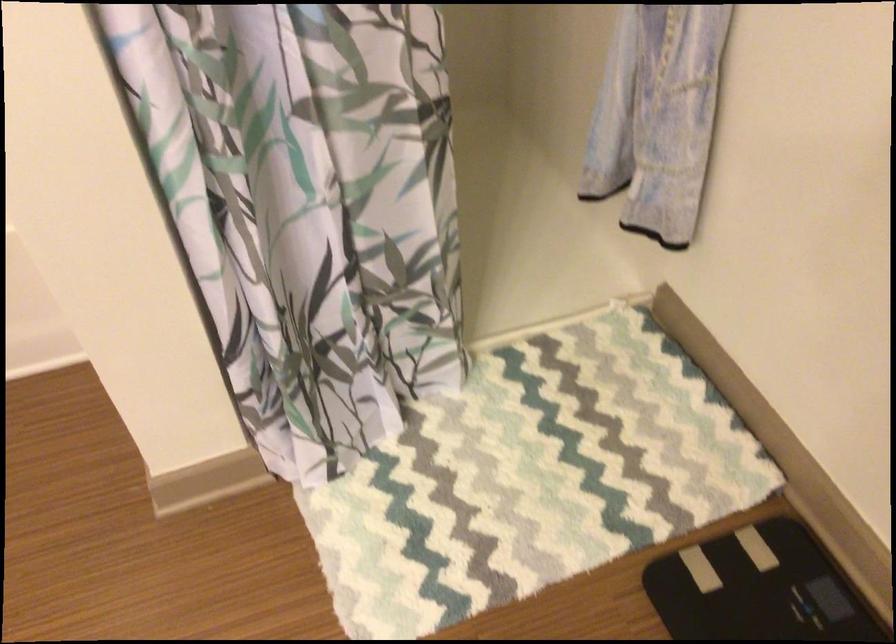
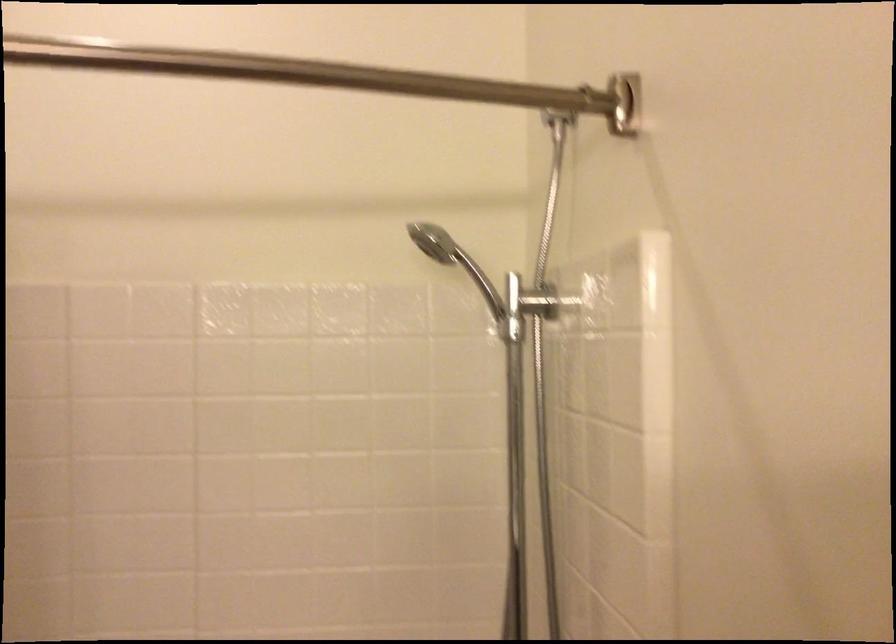
First-person continuous shooting, in which direction is the camera rotating?

The camera's rotation is toward left-up.